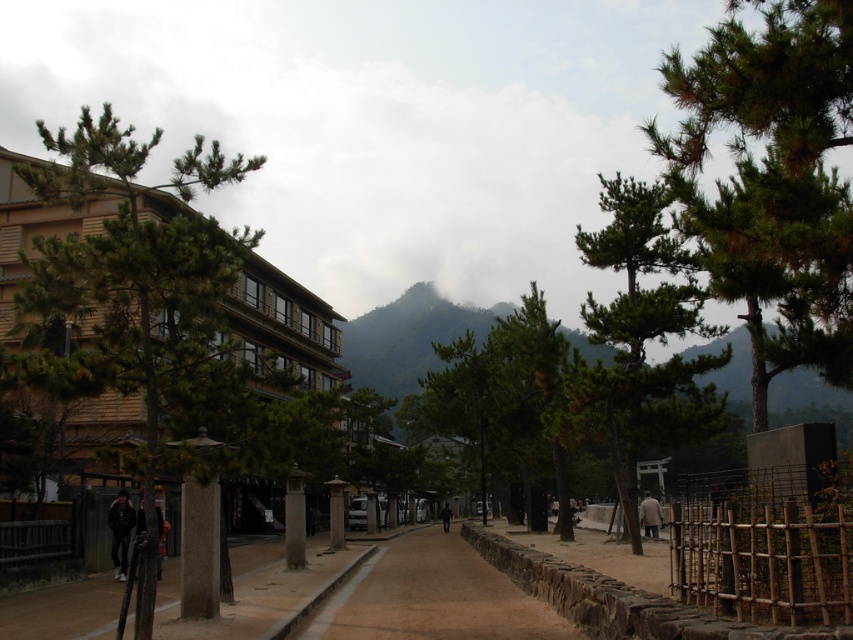
Question: Based on their relative distances, which object is nearer to the green needle-like leaves at upper right?

Choices:
 (A) green textured tree at left
 (B) green textured mountain at center
 (C) green textured tree at right

Answer: (C)

Question: Which object is the farthest from the brown stone path at center?

Choices:
 (A) green textured tree at right
 (B) green textured mountain at center
 (C) green needle-like leaves at upper right

Answer: (B)

Question: Among these objects, which one is nearest to the camera?

Choices:
 (A) green textured tree at left
 (B) green textured tree at right
 (C) green needle-like leaves at upper right
 (D) brown stone path at center

Answer: (C)

Question: Is green needle-like leaves at upper right behind brown stone path at center?

Choices:
 (A) yes
 (B) no

Answer: (B)

Question: Can you confirm if green textured tree at left is positioned to the right of brown stone path at center?

Choices:
 (A) yes
 (B) no

Answer: (B)

Question: Is green textured tree at left bigger than green textured mountain at center?

Choices:
 (A) yes
 (B) no

Answer: (B)